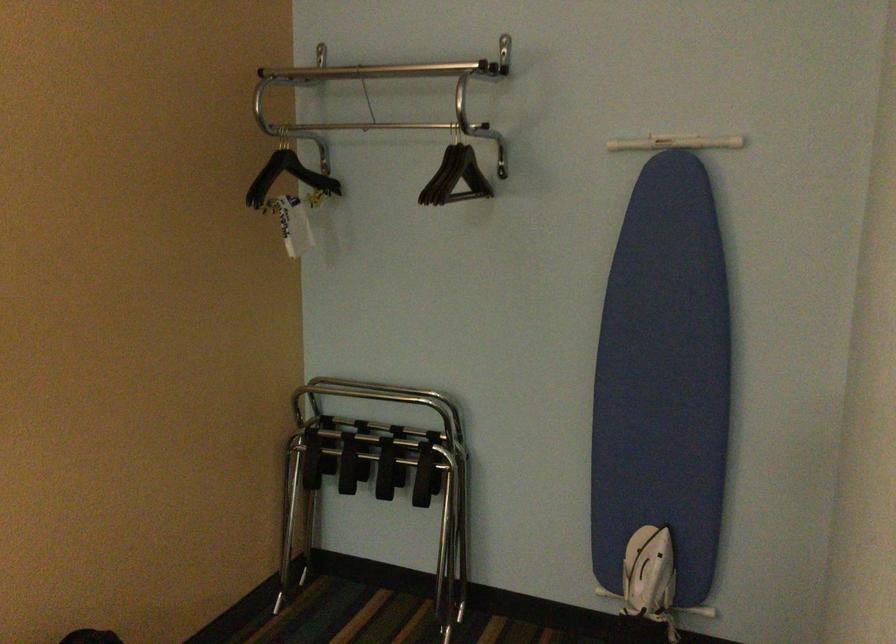
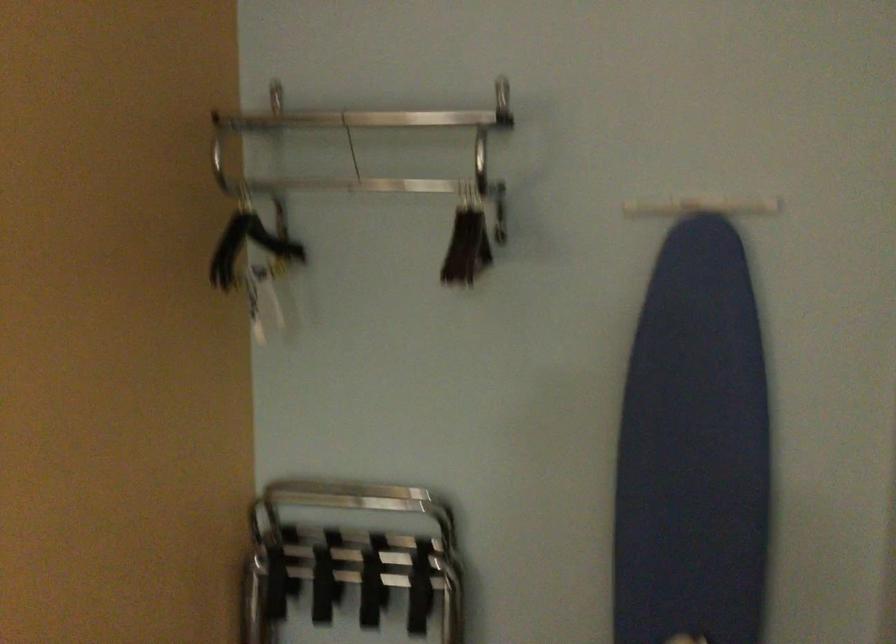
Locate, in the second image, the point that corresponds to the point at 660,363 in the first image.

(694, 449)